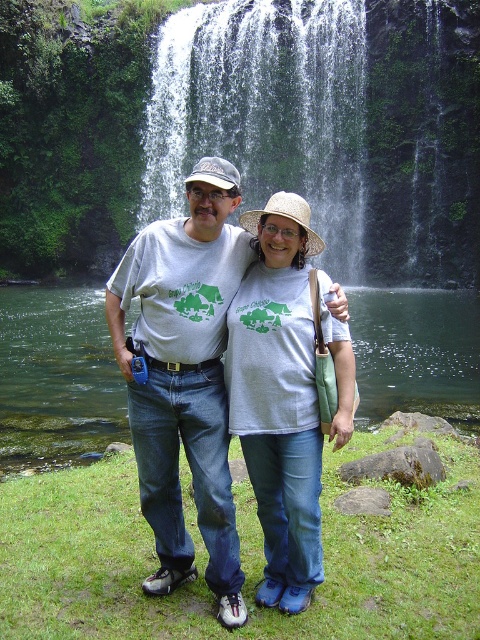
Which is in front, point (203, 77) or point (222, 417)?

Point (222, 417)

Can you confirm if white textured water at center is taller than matte gray t-shirt at center?

Indeed, white textured water at center has a greater height compared to matte gray t-shirt at center.

This screenshot has height=640, width=480. Identify the location of white textured water at center. (265, 109).

The image size is (480, 640). Find the location of `white textured water at center`. white textured water at center is located at coordinates (265, 109).

Does matte gray t-shirt at center have a lesser width compared to matte gray shirt at center?

No, matte gray t-shirt at center is not thinner than matte gray shirt at center.

Between matte gray t-shirt at center and matte gray shirt at center, which one appears on the left side from the viewer's perspective?

matte gray t-shirt at center is more to the left.

The image size is (480, 640). What are the coordinates of `matte gray t-shirt at center` in the screenshot? It's located at (184, 376).

In the scene shown: Does white textured water at center appear on the left side of matte gray shirt at center?

Incorrect, white textured water at center is not on the left side of matte gray shirt at center.

Describe the element at coordinates (265, 109) in the screenshot. I see `white textured water at center` at that location.

Locate an element on the screen. The width and height of the screenshot is (480, 640). white textured water at center is located at coordinates (265, 109).